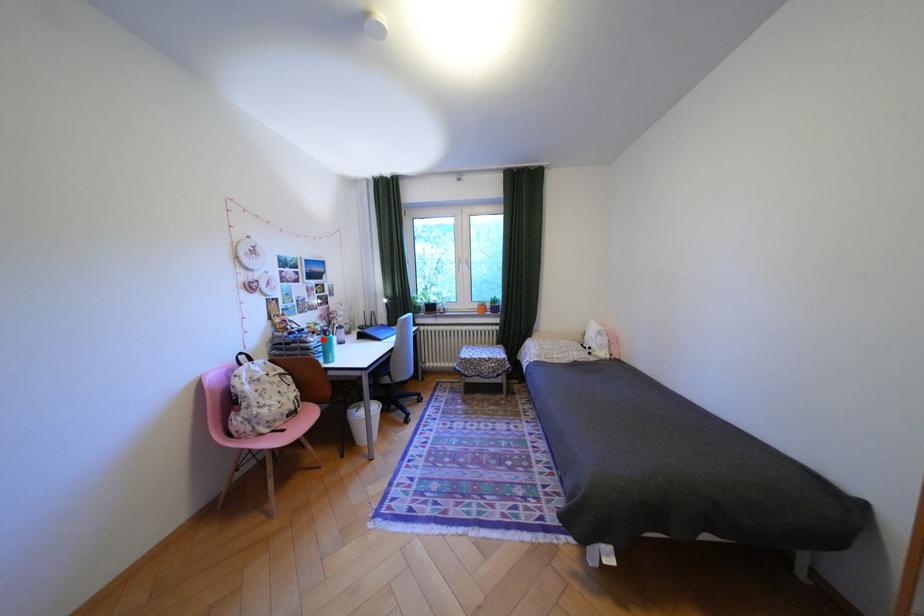
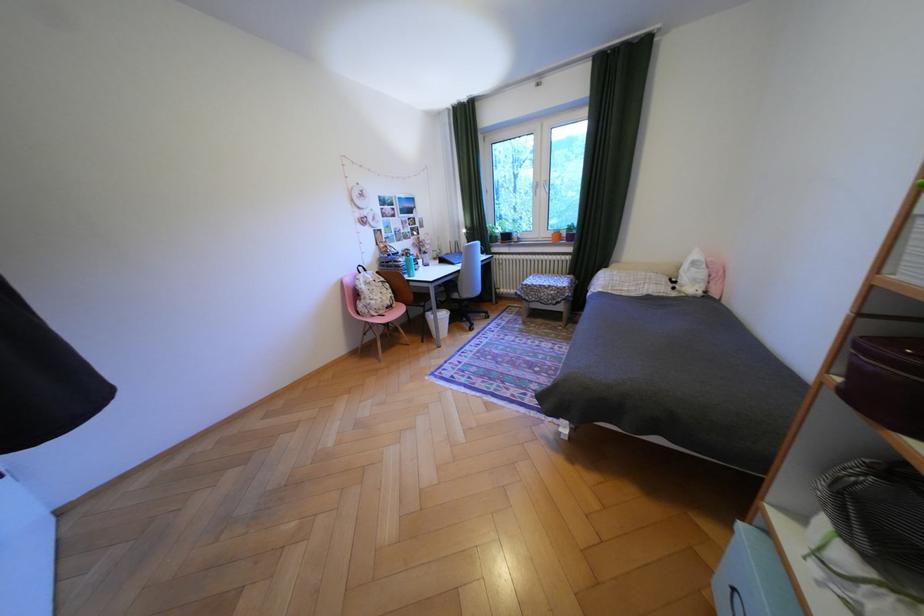
Question: I am providing you with two images of the same scene from different viewpoints. A red point is marked on the first image. At the location where the point appears in image 1, is it still visible in image 2?

Choices:
 (A) Yes
 (B) No

Answer: (A)